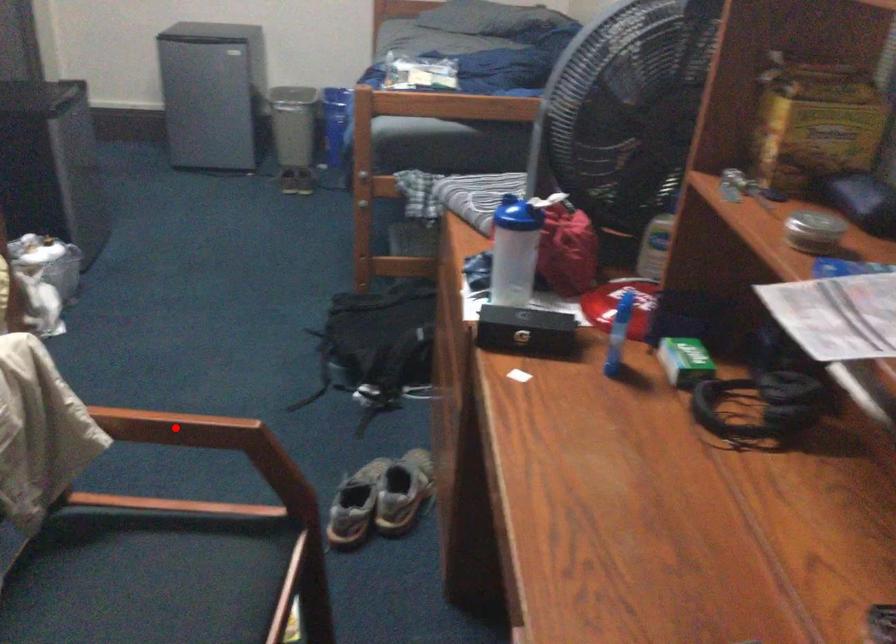
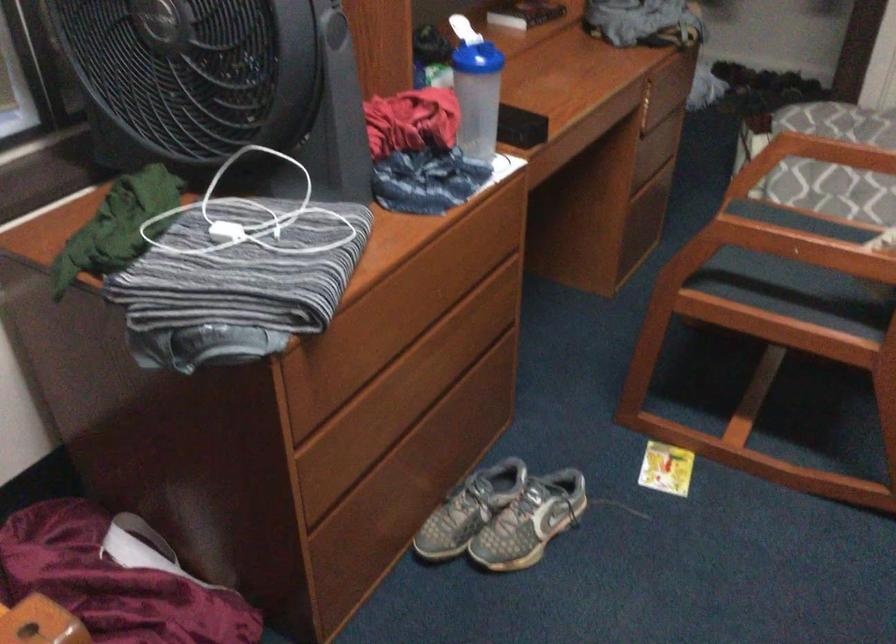
Question: I am providing you with two images of the same scene from different viewpoints. A red point is marked on the first image. At the location where the point appears in image 1, is it still visible in image 2?

Choices:
 (A) Yes
 (B) No

Answer: (B)